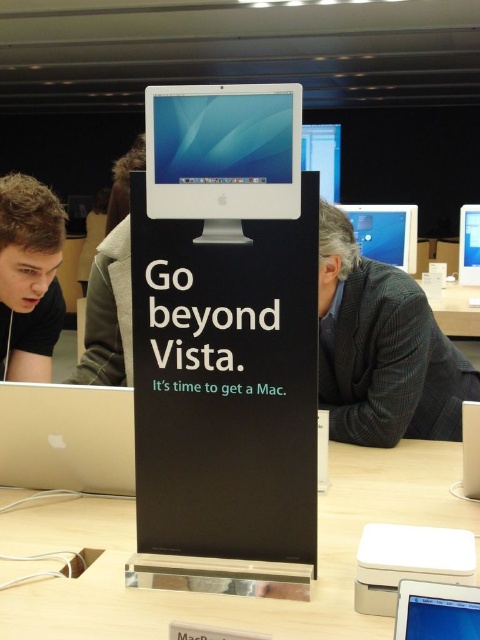
Is point (475, 614) positioned before point (377, 205)?

Yes, it is in front of point (377, 205).

Who is lower down, silver metallic monitor at center or matte black monitor at upper center?

Positioned lower is silver metallic monitor at center.

Is point (475, 595) positioned before point (351, 205)?

Yes.

Image resolution: width=480 pixels, height=640 pixels. I want to click on silver metallic monitor at center, so click(436, 611).

Is silver metallic laptop at lower left behind blonde hair at left?

No, silver metallic laptop at lower left is closer to the viewer.

Does silver metallic laptop at lower left have a lesser width compared to blonde hair at left?

No, silver metallic laptop at lower left is not thinner than blonde hair at left.

Between point (60, 429) and point (59, 300), which one is positioned behind?

The point (59, 300) is more distant.

This screenshot has height=640, width=480. What are the coordinates of `silver metallic laptop at lower left` in the screenshot? It's located at (67, 436).

Which of these two, silver metallic laptop at lower left or light brown leather jacket at upper left, stands taller?

light brown leather jacket at upper left

Is silver metallic laptop at lower left taller than light brown leather jacket at upper left?

No.

Is point (0, 387) positioned behind point (95, 241)?

No, (0, 387) is closer to viewer.

Locate an element on the screen. silver metallic laptop at lower left is located at coordinates (x=67, y=436).